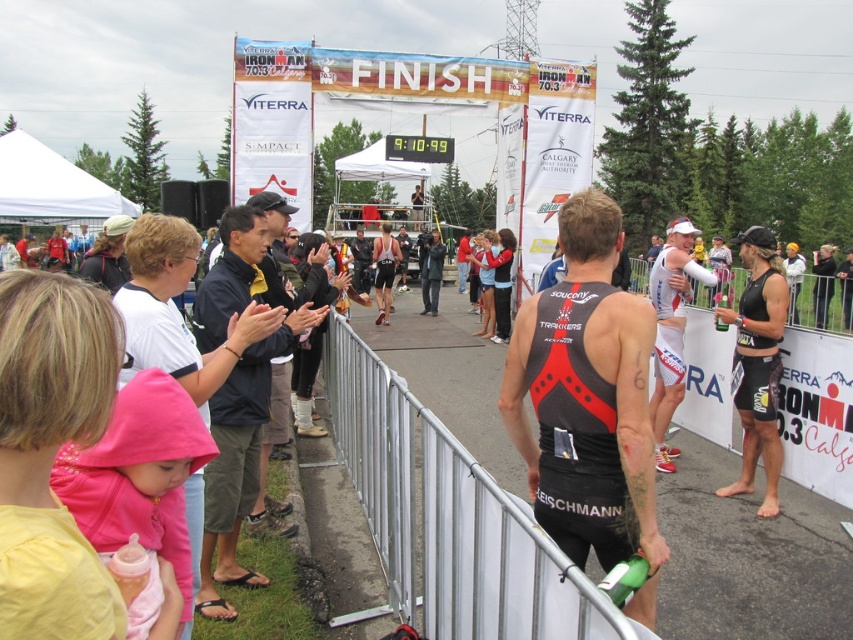
In the Ironman 70.3 triathlon finish line scene, you notice two athletes wearing black matte triathlon suit at right and black spandex tank top at center. Which athlete is positioned further to the right?

The black matte triathlon suit at right is positioned to the right of the black spandex tank top at center, so the athlete in the black matte triathlon suit at right is further to the right.

You are an athlete approaching the finish line at the Ironman 70.3 triathlon in Calgary. You notice a dark blue jacket at center and a black matte triathlon suit at right. Which piece of clothing is positioned higher in the image?

The dark blue jacket at center is positioned higher than the black matte triathlon suit at right in the image.

You are an event organizer at the Ironman 70.3 triathlon in Calgary. You need to determine which athlete is shorter based on their clothing. Which athlete is shorter between the black matte triathlon suit at center and the black spandex tank top at center?

The athlete wearing the black matte triathlon suit at center is shorter compared to the athlete wearing the black spandex tank top at center because the black matte triathlon suit at center has a lesser height.